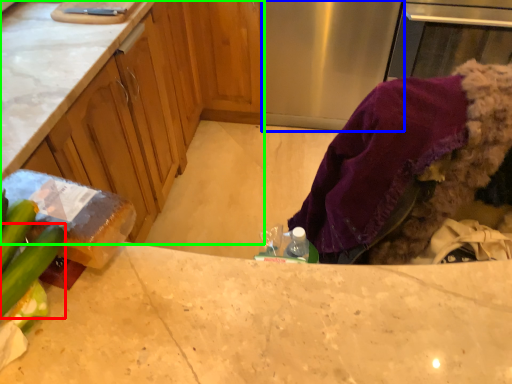
Question: Estimate the real-world distances between objects in this image. Which object is farther from cucumber (highlighted by a red box), appliance (highlighted by a blue box) or cabinetry (highlighted by a green box)?

Choices:
 (A) appliance
 (B) cabinetry

Answer: (A)